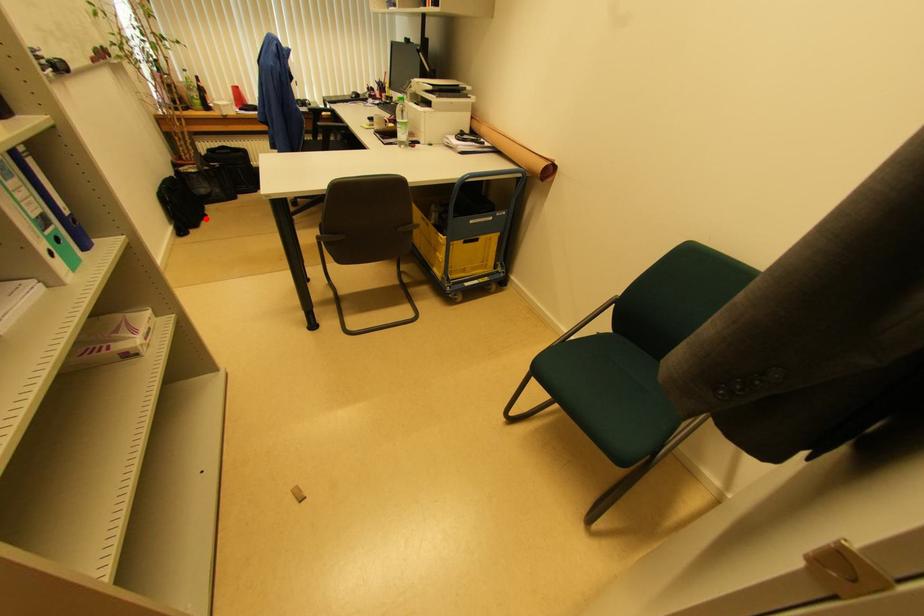
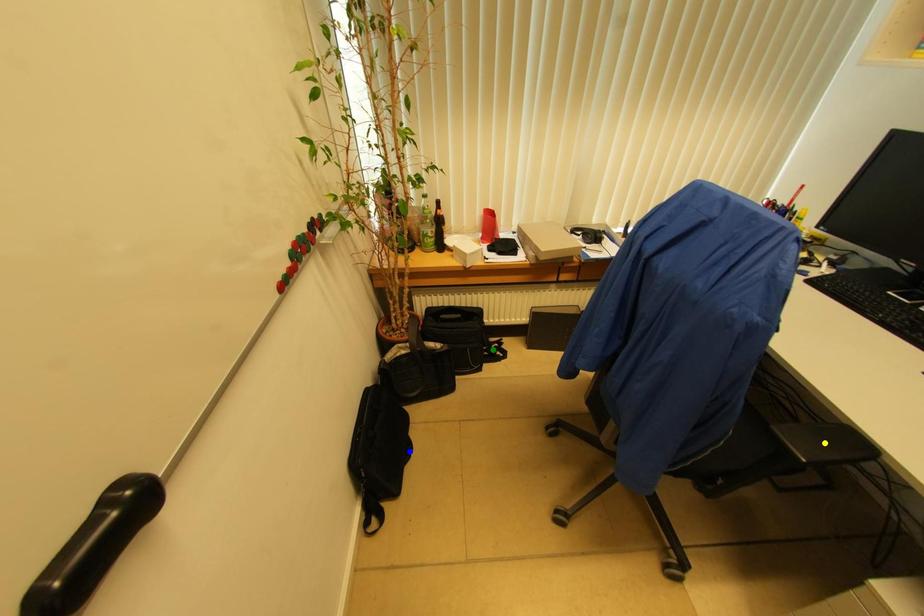
Question: I am providing you with two images of the same scene from different viewpoints. A red point is marked on the first image. You are given multiple points on the second image. Can you choose the point in image 2 that corresponds to the point in image 1?

Choices:
 (A) yellow point
 (B) green point
 (C) blue point

Answer: (C)